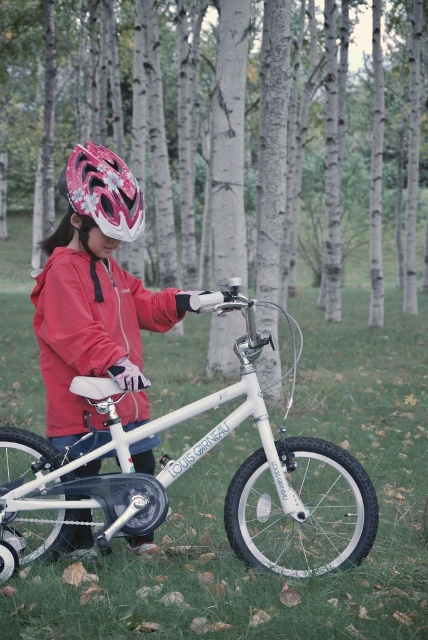
You are trying to decide whether to hang a small birdhouse on the white smooth tree at center or the matte red jacket at center. Based on their sizes, which object would be more suitable for the birdhouse?

The white smooth tree at center is bigger than the matte red jacket at center, so the birdhouse would be more suitable to hang on the white smooth tree at center.

You are a photographer trying to capture a photo of the white smooth tree at center and the matte pink helmet at upper left. Which object should you focus on first to ensure it appears sharp in the photo?

You should focus on the white smooth tree at center first because it is closer to the viewer than the matte pink helmet at upper left, so it will be in focus first.

You are a painter setting up an easel to paint the scene. You want to ensure that the white smooth tree at center and the white matte bicycle at center are both clearly visible in your painting. Given their sizes, which object should you place closer to the foreground to maintain their visibility?

The white smooth tree at center is bigger than the white matte bicycle at center, so to maintain visibility of both, you should place the smaller white matte bicycle at center closer to the foreground.